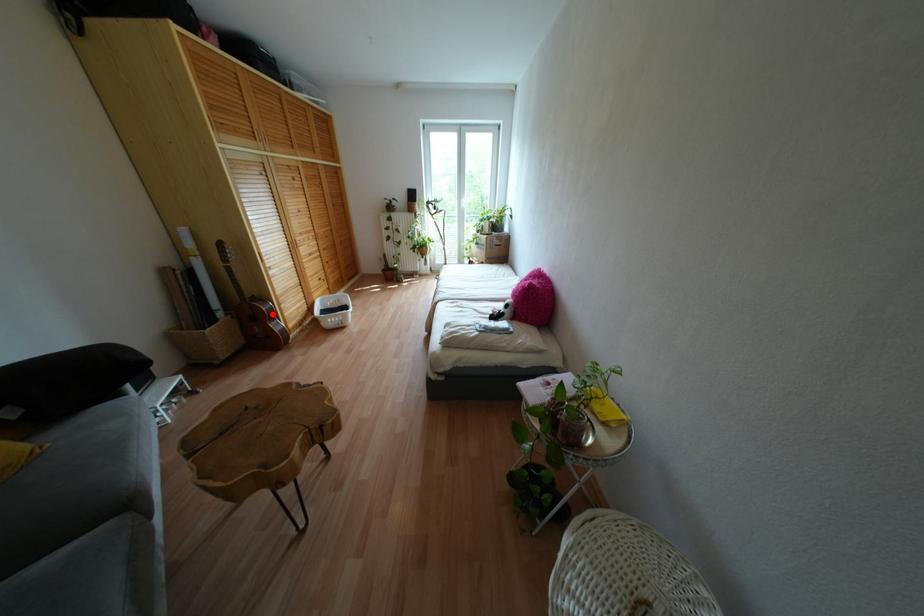
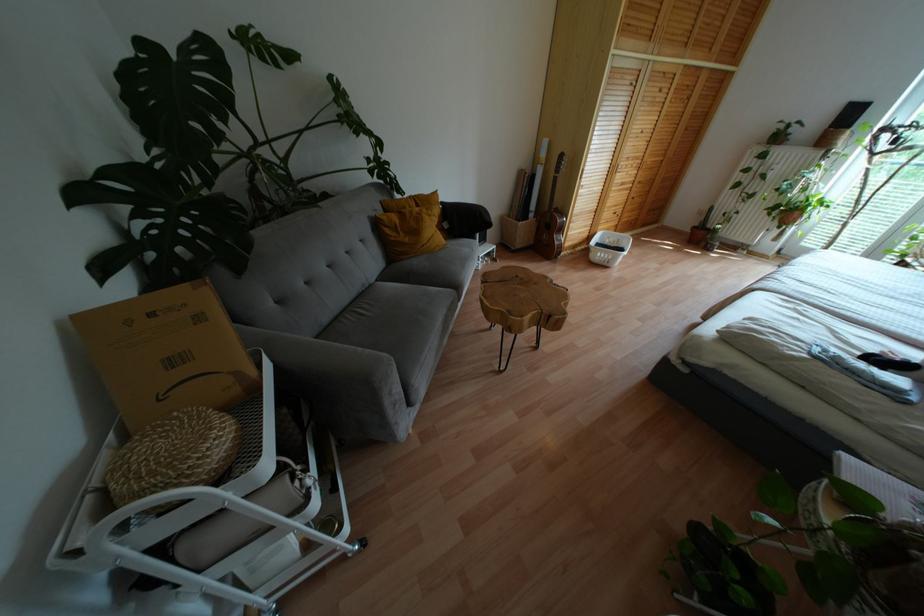
Where in the second image is the point corresponding to the highlighted location from the first image?

(560, 229)